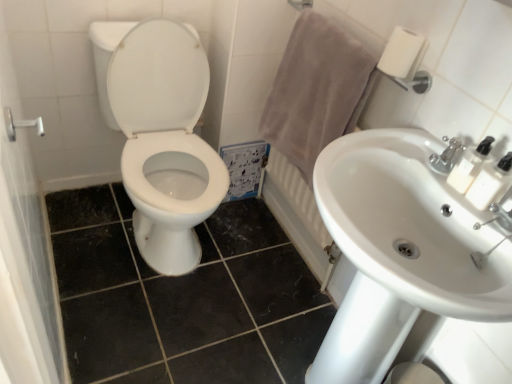
Find the location of `free spot to the right of white glossy toilet at center`. free spot to the right of white glossy toilet at center is located at coordinates point(254,255).